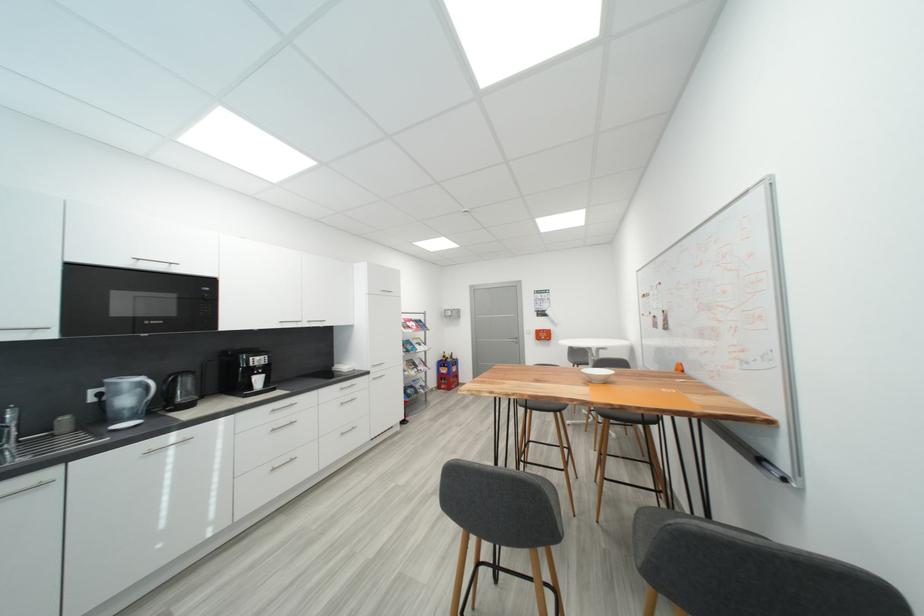
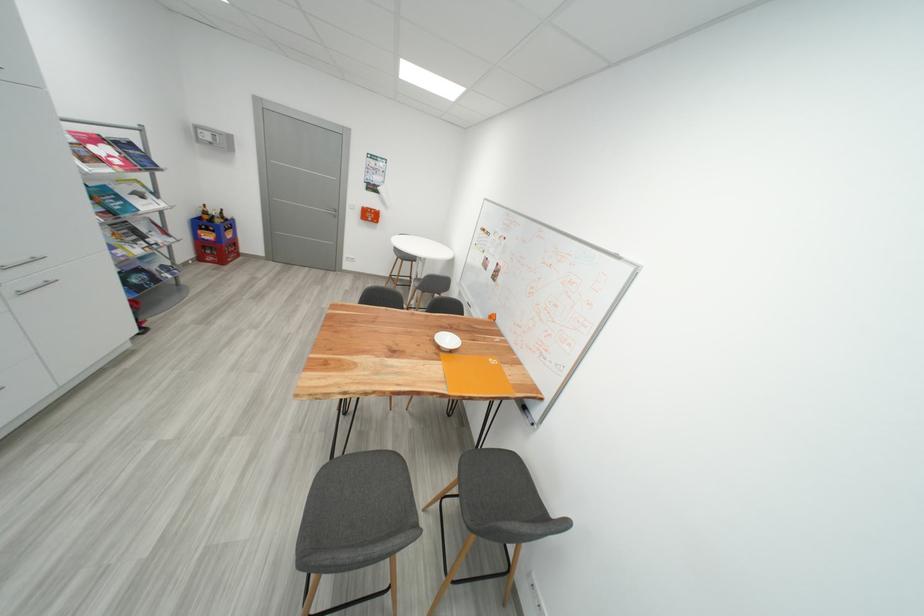
Where in the second image is the point corresponding to [456,362] from the first image?

(225, 223)